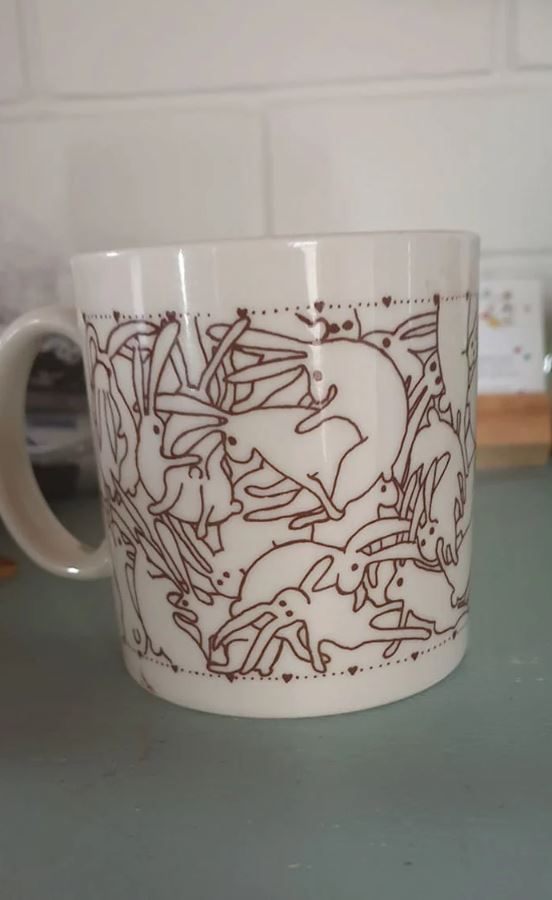
Find the location of a particular element. white brick is located at coordinates (193, 147), (373, 181), (256, 75).